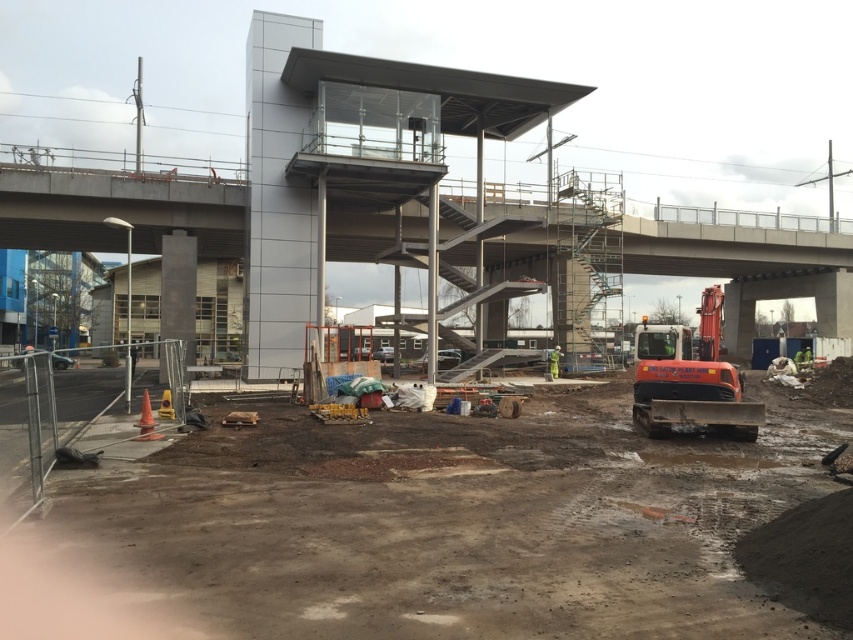
You are a delivery driver with a truck that is 3 meters tall. You need to drive through the construction site shown in the image. Can your truck pass under the concrete overpass at center without hitting the orange rubber excavator at lower right?

The concrete overpass at center is taller than the orange rubber excavator at lower right. Since the truck is 3 meters tall, it can safely pass under the concrete overpass at center as long as it avoids the orange rubber excavator at lower right which is shorter and positioned lower.

You are a construction worker who needs to move a heavy beam from the concrete overpass at center to the orange rubber excavator at lower right. Which object is located to the left of the other?

The concrete overpass at center is positioned on the left side of orange rubber excavator at lower right, so the beam should be moved from the left side to the excavator on the right.